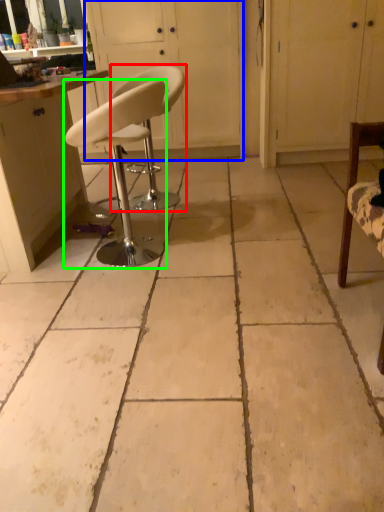
Question: Considering the real-world distances, which object is closest to chair (highlighted by a red box)? screen door (highlighted by a blue box) or chair (highlighted by a green box).

Choices:
 (A) screen door
 (B) chair

Answer: (B)